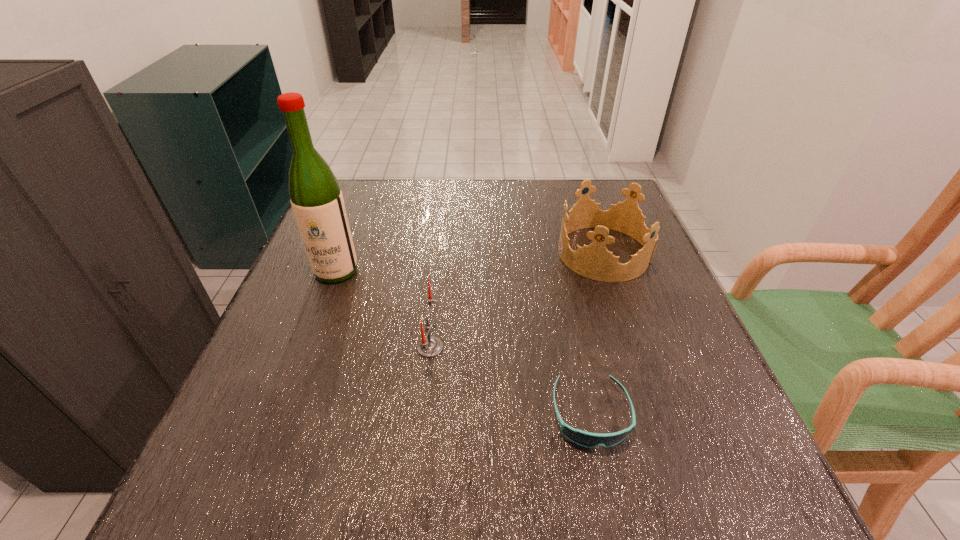
Image resolution: width=960 pixels, height=540 pixels. I want to click on vacant region between the second object from left to right and the leftmost object, so click(383, 309).

You are a GUI agent. You are given a task and a screenshot of the screen. Output one action in this format:
    pyautogui.click(x=<x>, y=<y>)
    Task: Click on the vacant area that lies between the sunglasses and the candle
    
    Given the screenshot: What is the action you would take?
    pyautogui.click(x=511, y=381)

Point out which object is positioned as the third nearest to the tiara. Please provide its 2D coordinates. Your answer should be formatted as a tuple, i.e. [(x, y)], where the tuple contains the x and y coordinates of a point satisfying the conditions above.

[(315, 195)]

Locate an element on the screen. The image size is (960, 540). object that is the second closest to the tallest object is located at coordinates (594, 261).

Locate an element on the screen. This screenshot has height=540, width=960. blank area in the image that satisfies the following two spatial constraints: 1. on the front-facing side of the tiara; 2. on the label of the leftmost object is located at coordinates (611, 271).

Locate an element on the screen. Image resolution: width=960 pixels, height=540 pixels. vacant space that satisfies the following two spatial constraints: 1. on the front-facing side of the tiara; 2. on the front-facing side of the nearest object is located at coordinates (660, 414).

Where is `blank space that satisfies the following two spatial constraints: 1. on the front-facing side of the tiara; 2. on the label of the liquor`? This screenshot has width=960, height=540. blank space that satisfies the following two spatial constraints: 1. on the front-facing side of the tiara; 2. on the label of the liquor is located at coordinates (611, 271).